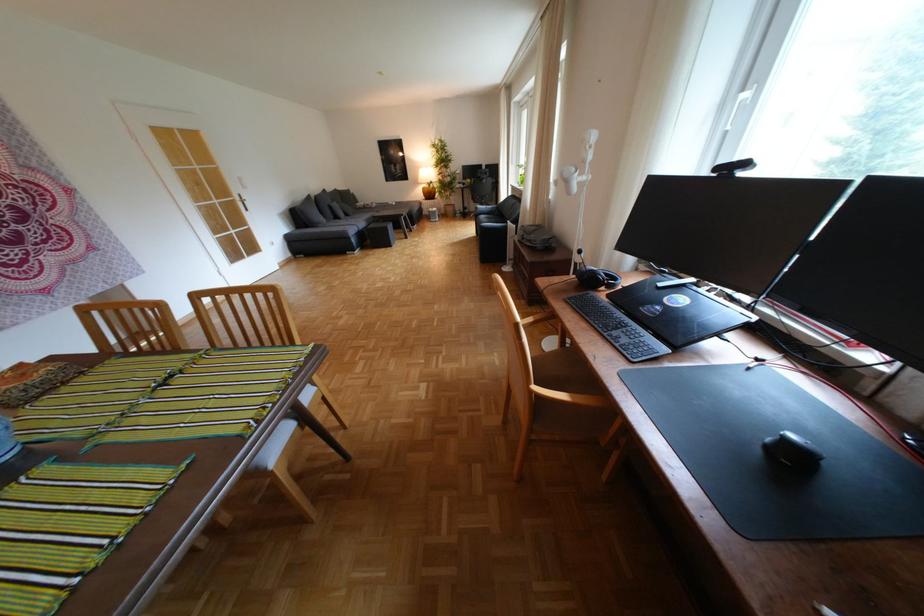
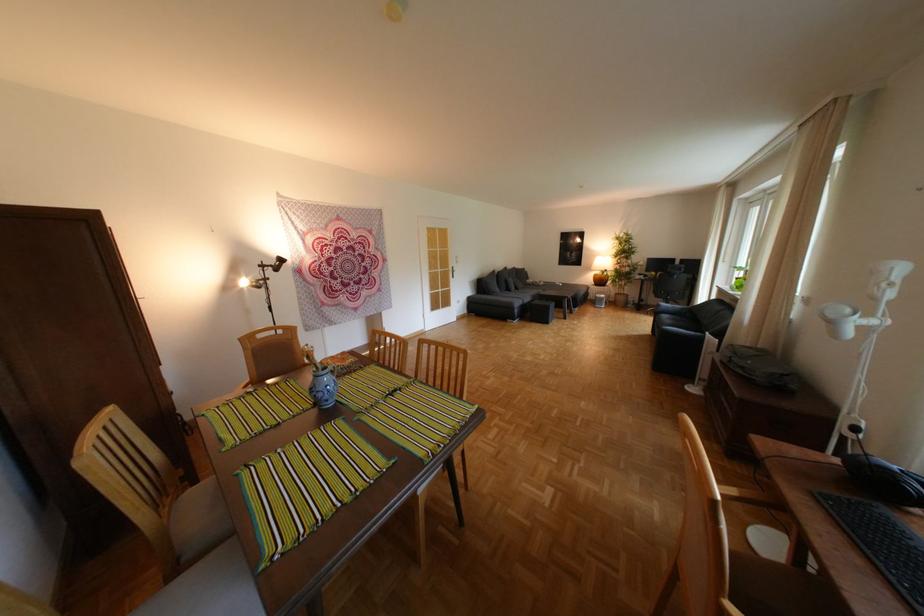
Find the pixel in the second image that matches (x=446, y=161) in the first image.

(626, 252)